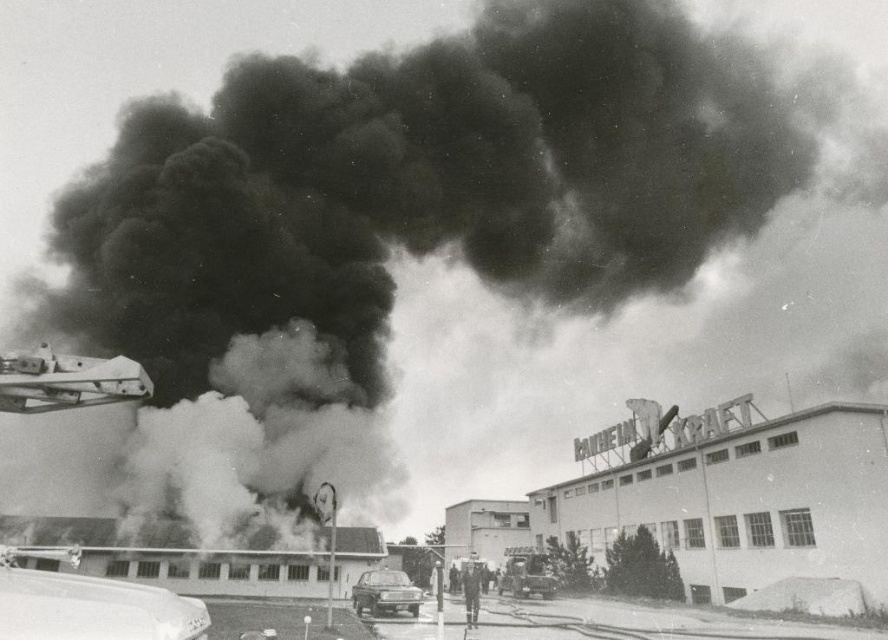
You are a delivery driver who needs to park your shiny silver car at lower left and metallic silver car at center in a parking lot with spaces that are 4 meters wide. Can both cars fit into their respective spaces without overlapping?

The shiny silver car at lower left is wider than the metallic silver car at center. Since the parking spaces are 4 meters wide, both cars can fit as long as their individual widths do not exceed 4 meters. However, the description only states the relative size between them, not their absolute sizes. Without knowing the exact width of each car, it is impossible to determine if they will fit into the 4 meter spaces.

You are a photographer trying to capture both the shiny silver car at lower left and the metallic silver car at center in a single frame. Given their height difference, which car should you position closer to the camera to ensure both appear equally tall in the photo?

The shiny silver car at lower left is much taller than the metallic silver car at center. To make them appear equally tall in the photo, you should position the metallic silver car at center closer to the camera since it is shorter and needs to be magnified more to match the height of the taller car in the frame.